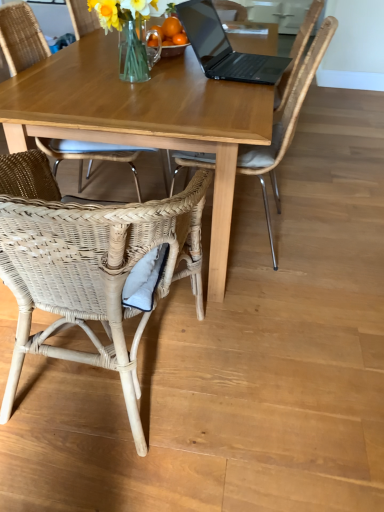
I want to click on free space to the right of wooden table at center, so (327, 189).